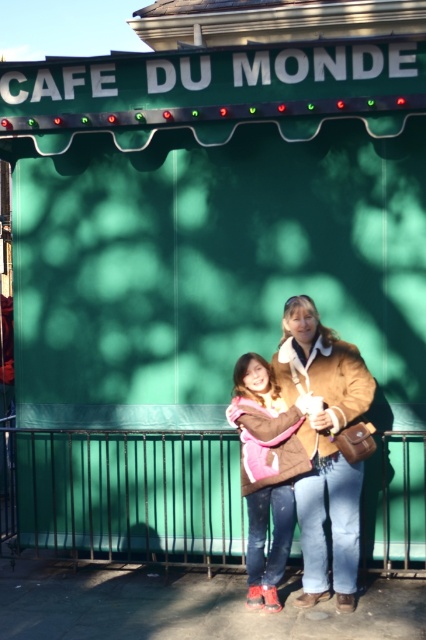
Question: Which object appears farthest from the camera in this image?

Choices:
 (A) brown suede jacket at center
 (B) brown fuzzy jacket at center

Answer: (A)

Question: Does brown suede jacket at center lie behind brown fuzzy jacket at center?

Choices:
 (A) yes
 (B) no

Answer: (A)

Question: Does brown suede jacket at center have a greater width compared to brown fuzzy jacket at center?

Choices:
 (A) no
 (B) yes

Answer: (B)

Question: In this image, where is brown suede jacket at center located relative to brown fuzzy jacket at center?

Choices:
 (A) below
 (B) above

Answer: (B)